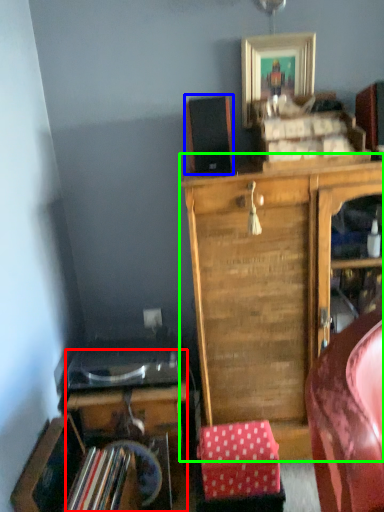
Question: Which is nearer to the desk (highlighted by a red box)? speaker (highlighted by a blue box) or cabinetry (highlighted by a green box).

Choices:
 (A) speaker
 (B) cabinetry

Answer: (B)